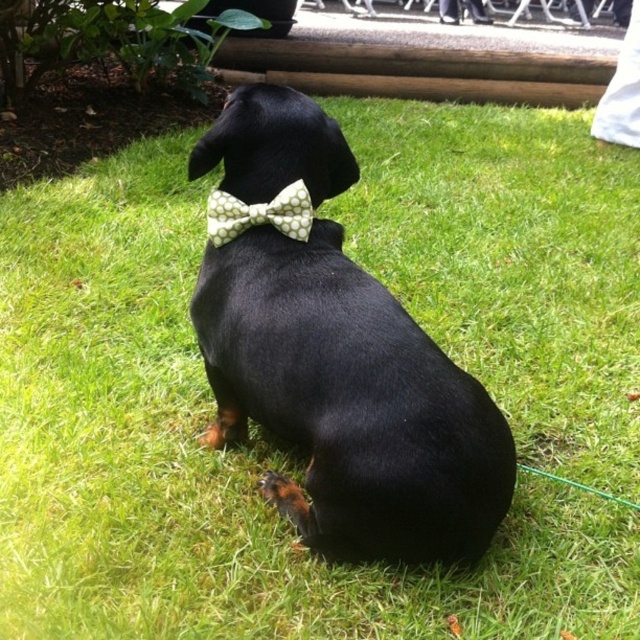
Question: Considering the relative positions of black matte bow tie at center and green dotted bow tie at center in the image provided, where is black matte bow tie at center located with respect to green dotted bow tie at center?

Choices:
 (A) below
 (B) above

Answer: (A)

Question: Does black matte bow tie at center appear over green dotted bow tie at center?

Choices:
 (A) no
 (B) yes

Answer: (A)

Question: Which of the following is the farthest from the observer?

Choices:
 (A) (276, 205)
 (B) (280, 288)

Answer: (A)

Question: Which object appears closest to the camera in this image?

Choices:
 (A) green dotted bow tie at center
 (B) black matte bow tie at center

Answer: (B)

Question: Is black matte bow tie at center positioned in front of green dotted bow tie at center?

Choices:
 (A) no
 (B) yes

Answer: (B)

Question: Which object appears farthest from the camera in this image?

Choices:
 (A) green dotted bow tie at center
 (B) black matte bow tie at center

Answer: (A)